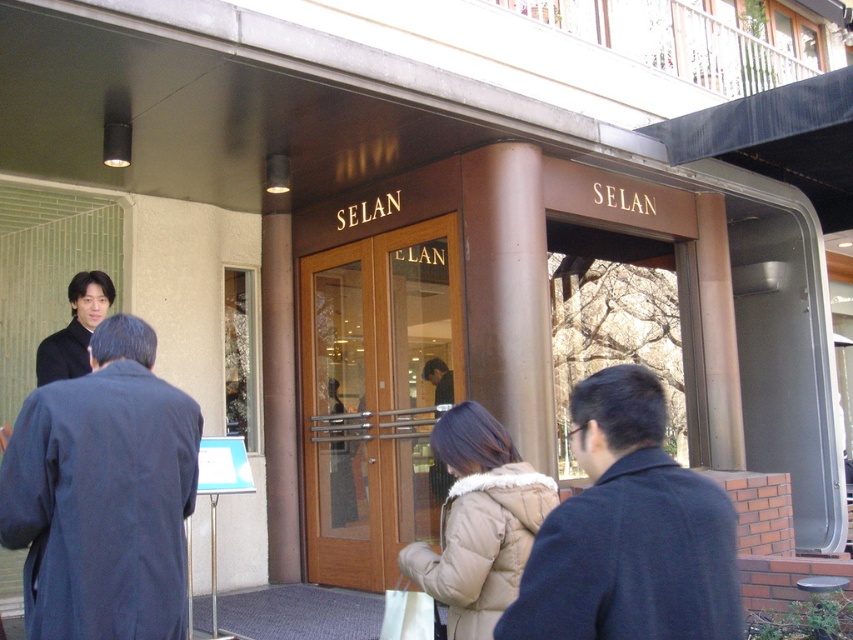
You are standing at the entrance of the building and need to greet two people wearing coats. The beige puffy coat at center and the matte black coat at center. Which one is positioned more to the left?

The beige puffy coat at center is to the right of matte black coat at center, so the matte black coat at center is positioned more to the left.

You are a security guard at the entrance of SELAN building. You need to let people through one by one. There is a dark blue coat at center and a matte black coat at center. Which coat is wider so you can decide who to let through first?

The dark blue coat at center might be wider than matte black coat at center, so the security guard should let the person wearing the dark blue coat at center through first to avoid blocking the entrance.